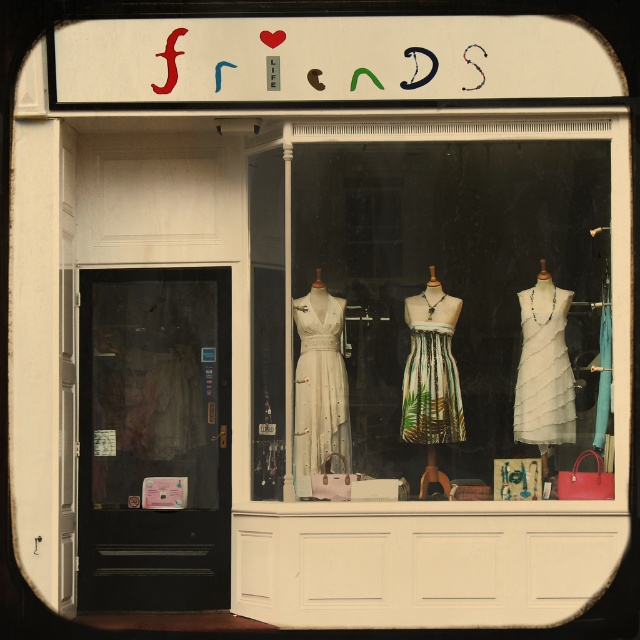
Question: Which object is the farthest from the light beige fabric dress at center?

Choices:
 (A) white chiffon dress at center
 (B) printed fabric dress at center
 (C) white fabric dress at center

Answer: (A)

Question: Is white chiffon dress at center bigger than printed fabric dress at center?

Choices:
 (A) no
 (B) yes

Answer: (A)

Question: Can you confirm if white chiffon dress at center is positioned below printed fabric dress at center?

Choices:
 (A) no
 (B) yes

Answer: (A)

Question: Does white chiffon dress at center have a larger size compared to printed fabric dress at center?

Choices:
 (A) no
 (B) yes

Answer: (A)

Question: Which object is positioned closest to the white chiffon dress at center?

Choices:
 (A) printed fabric dress at center
 (B) light beige fabric dress at center
 (C) white fabric dress at center

Answer: (C)

Question: Estimate the real-world distances between objects in this image. Which object is farther from the light beige fabric dress at center?

Choices:
 (A) printed fabric dress at center
 (B) white fabric dress at center
 (C) white chiffon dress at center

Answer: (C)